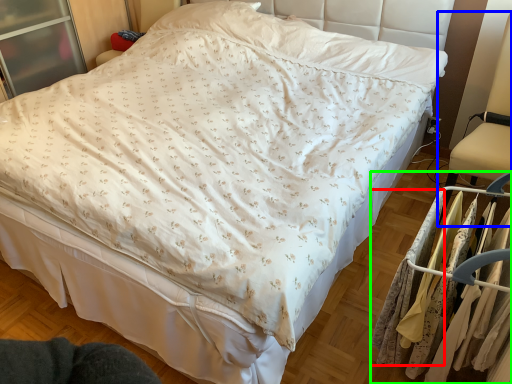
Question: Which is nearer to the clothing (highlighted by a red box)? swivel chair (highlighted by a blue box) or closet (highlighted by a green box).

Choices:
 (A) swivel chair
 (B) closet

Answer: (B)